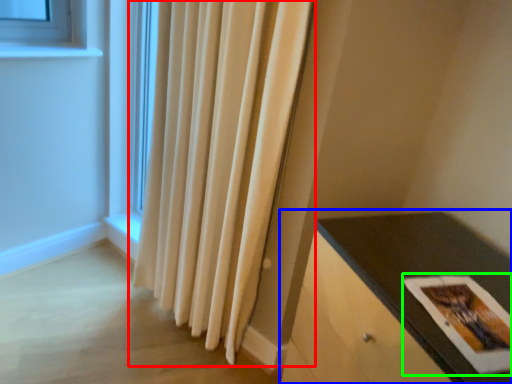
Question: Which object is the closest to the curtain (highlighted by a red box)? Choose among these: table (highlighted by a blue box) or postcard (highlighted by a green box).

Choices:
 (A) table
 (B) postcard

Answer: (A)